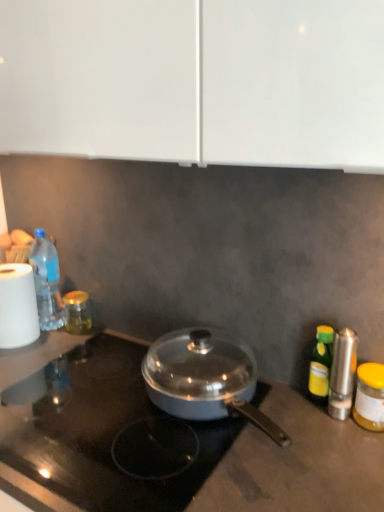
The image size is (384, 512). Identify the location of blank space situated above metallic gray pan at center (from a real-world perspective). (107, 405).